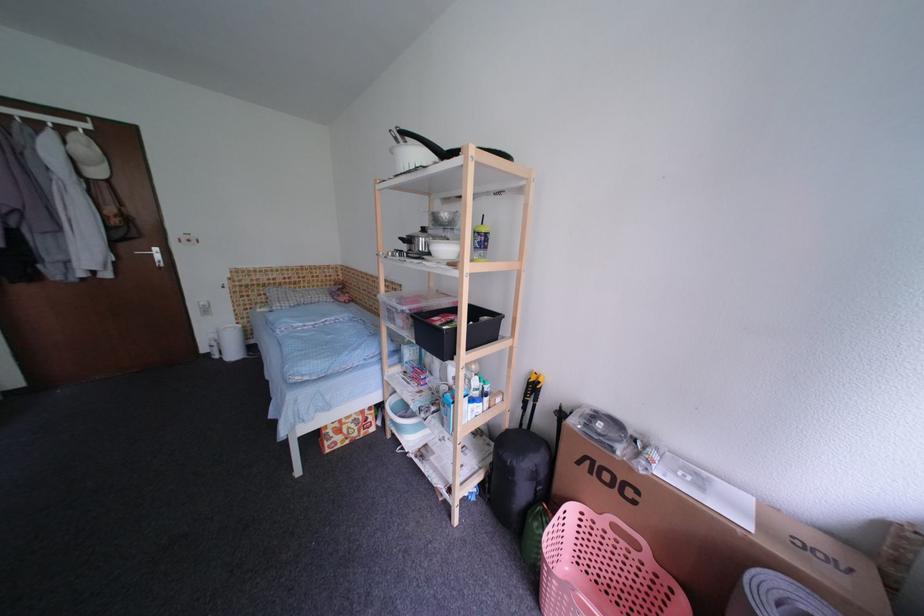
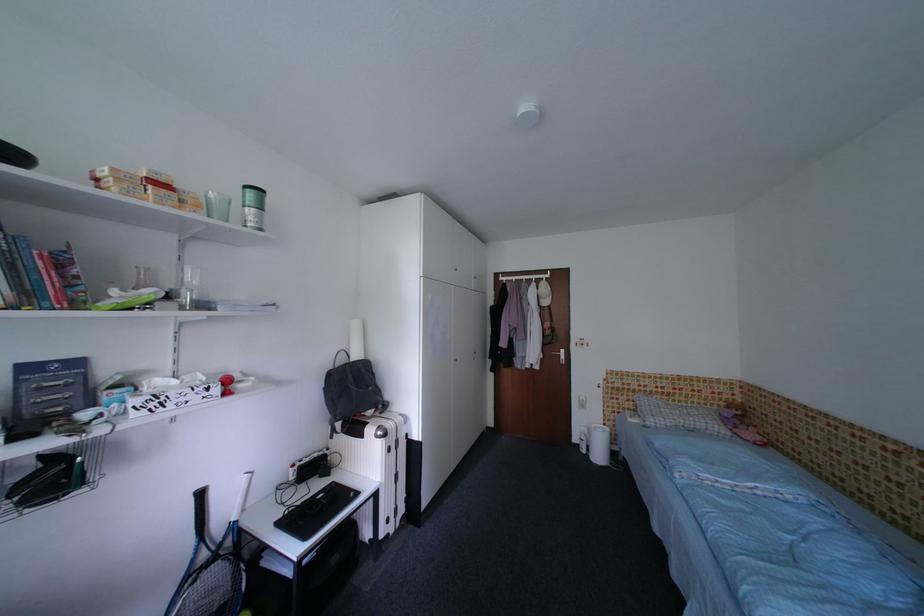
Question: The camera is either moving clockwise (left) or counter-clockwise (right) around the object. The first image is from the beginning of the video and the second image is from the end. Is the camera moving left or right when shooting the video?

Choices:
 (A) Left
 (B) Right

Answer: (B)